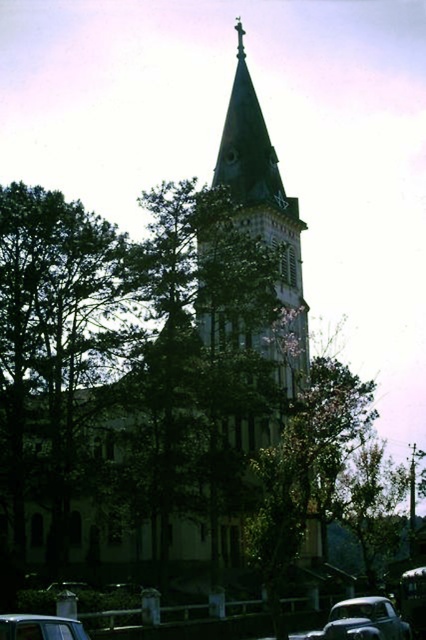
Question: Where is green leafy tree at center located in relation to metallic silver car at lower left in the image?

Choices:
 (A) right
 (B) left

Answer: (A)

Question: Among these objects, which one is nearest to the camera?

Choices:
 (A) metallic silver car at lower left
 (B) shiny silver car at lower center

Answer: (A)

Question: Which point is farther to the camera?

Choices:
 (A) (400, 627)
 (B) (150, 332)

Answer: (B)

Question: Is shiny silver car at lower center positioned before metallic silver car at lower left?

Choices:
 (A) no
 (B) yes

Answer: (A)

Question: Can you confirm if green leafy tree at center is positioned above metallic silver car at lower left?

Choices:
 (A) no
 (B) yes

Answer: (B)

Question: Which point is farther to the camera?

Choices:
 (A) shiny silver car at lower center
 (B) metallic silver car at lower left

Answer: (A)